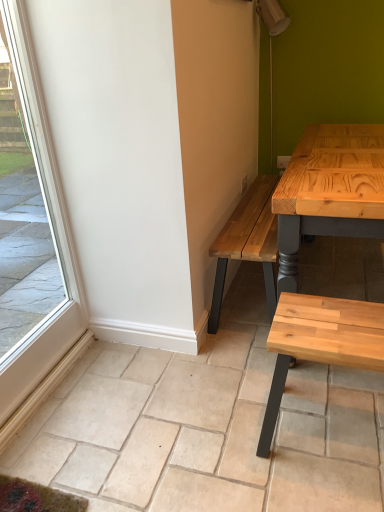
Where is `vacant space situated above natural wood bench at lower right (from a real-world perspective)`? vacant space situated above natural wood bench at lower right (from a real-world perspective) is located at coordinates (335, 320).